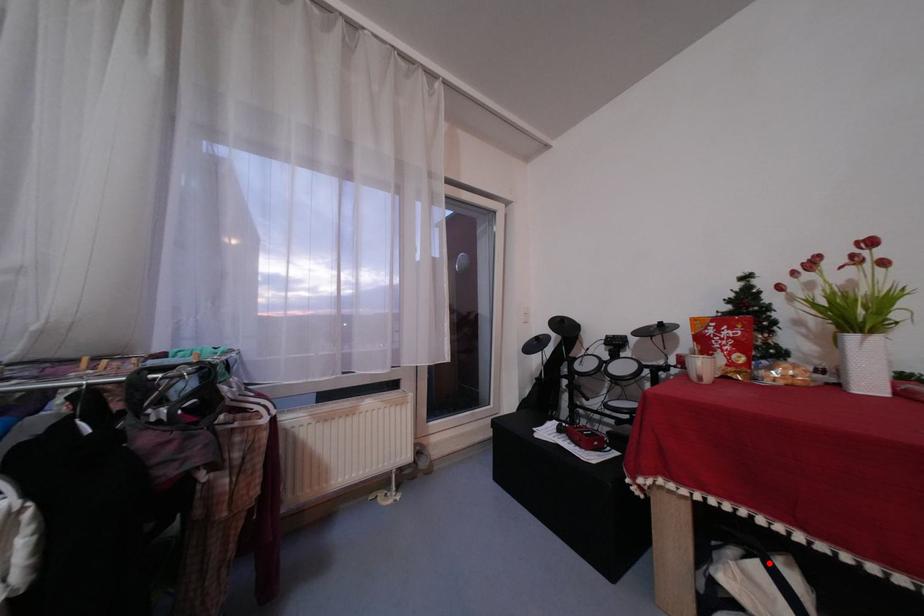
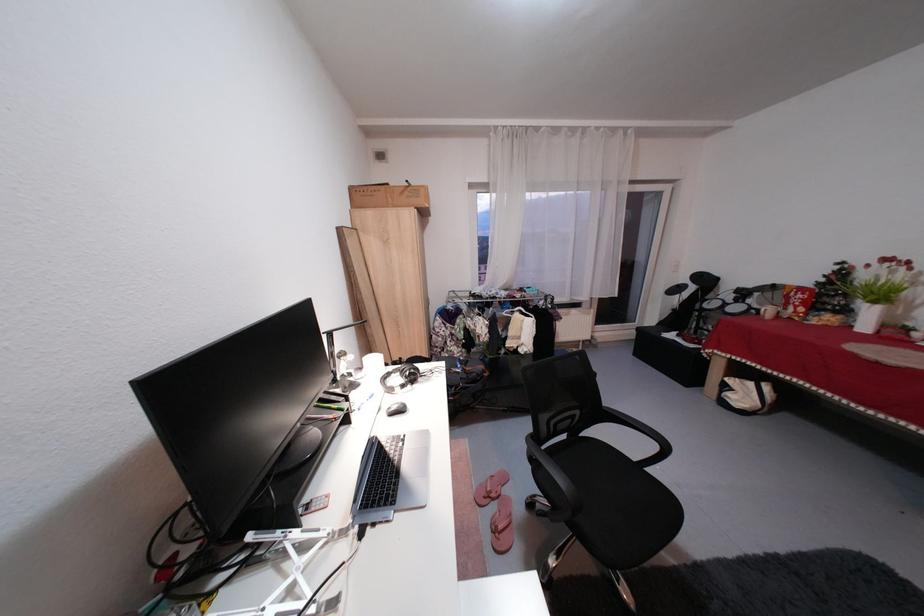
Question: I am providing you with two images of the same scene from different viewpoints. In image1, a red point is highlighted. Considering the same 3D point in image2, which of the following is correct?

Choices:
 (A) It is closer
 (B) It is farther

Answer: (B)